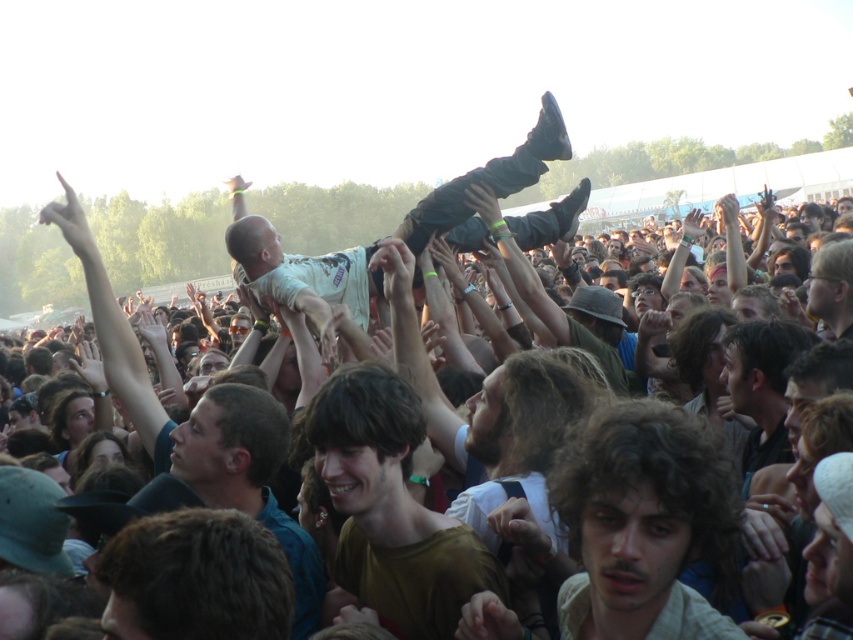
Question: Does brown hair at lower left appear on the left side of light brown fabric baby at center?

Choices:
 (A) yes
 (B) no

Answer: (A)

Question: Does brown matte shirt at center appear on the left side of light brown fabric baby at center?

Choices:
 (A) yes
 (B) no

Answer: (A)

Question: Is brown hair at lower left thinner than light brown fabric baby at center?

Choices:
 (A) no
 (B) yes

Answer: (B)

Question: Which object appears closest to the camera in this image?

Choices:
 (A) brown hair at lower left
 (B) brown matte shirt at center
 (C) light brown fabric baby at center

Answer: (A)

Question: Among these points, which one is farthest from the camera?

Choices:
 (A) (310, 632)
 (B) (614, 458)
 (C) (527, 177)
 (D) (401, 573)

Answer: (C)

Question: Which object appears closest to the camera in this image?

Choices:
 (A) brown matte shirt at center
 (B) brown hair at lower left
 (C) light brown fabric baby at center

Answer: (B)